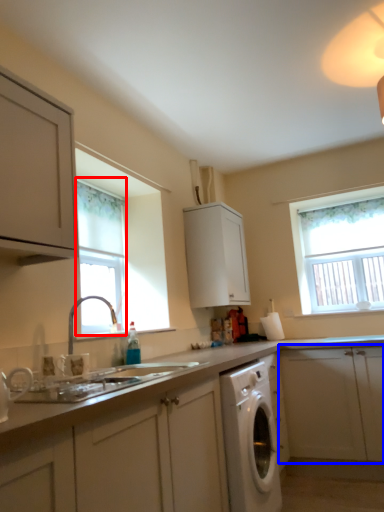
Question: Which point is closer to the camera, window (highlighted by a red box) or cabinetry (highlighted by a blue box)?

Choices:
 (A) window
 (B) cabinetry

Answer: (A)